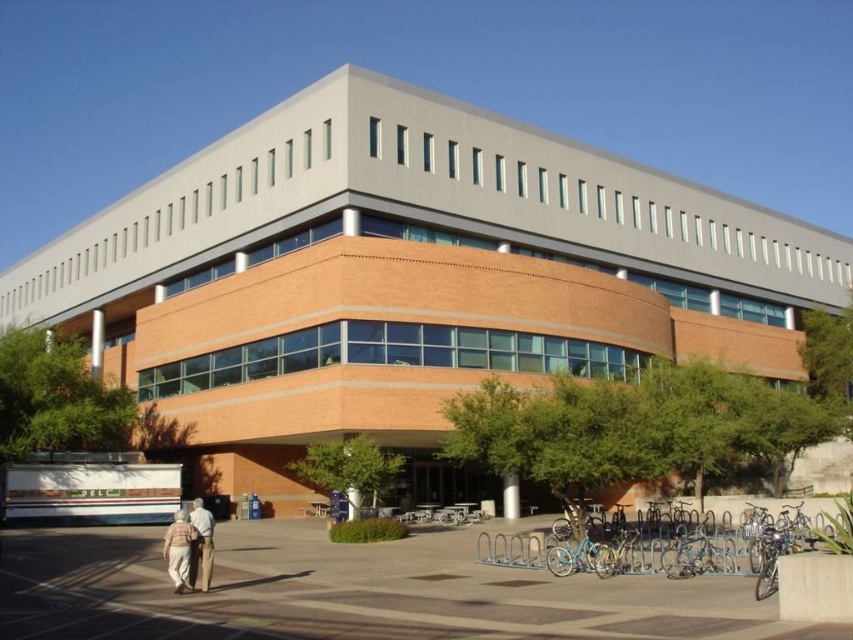
Does light brown pants at lower left have a lesser width compared to light beige fabric pants at lower left?

Incorrect, light brown pants at lower left's width is not less than light beige fabric pants at lower left's.

Which is above, light brown pants at lower left or light beige fabric pants at lower left?

Positioned higher is light brown pants at lower left.

Does point (210, 515) come closer to viewer compared to point (181, 518)?

No.

I want to click on light brown pants at lower left, so click(200, 545).

Is brick building at center further to the viewer compared to light beige fabric pants at lower left?

Yes, it is.

Does brick building at center have a greater width compared to light beige fabric pants at lower left?

Yes, brick building at center is wider than light beige fabric pants at lower left.

The image size is (853, 640). In order to click on brick building at center in this screenshot , I will do `click(407, 275)`.

How much distance is there between brick building at center and light brown pants at lower left?

brick building at center is 39.26 meters from light brown pants at lower left.

Is point (248, 444) positioned before point (196, 547)?

No, (248, 444) is behind (196, 547).

The height and width of the screenshot is (640, 853). What do you see at coordinates (407, 275) in the screenshot?
I see `brick building at center` at bounding box center [407, 275].

You are a GUI agent. You are given a task and a screenshot of the screen. Output one action in this format:
    pyautogui.click(x=<x>, y=<y>)
    Task: Click on the brick building at center
    Image resolution: width=853 pixels, height=640 pixels.
    Given the screenshot: What is the action you would take?
    pyautogui.click(x=407, y=275)